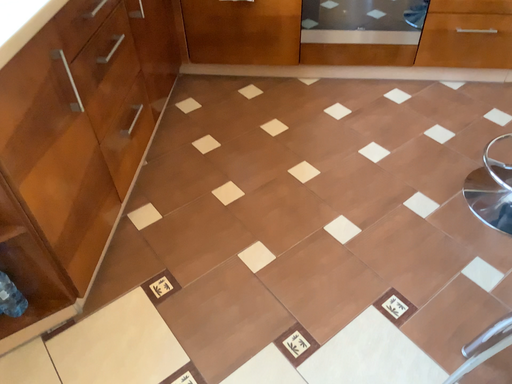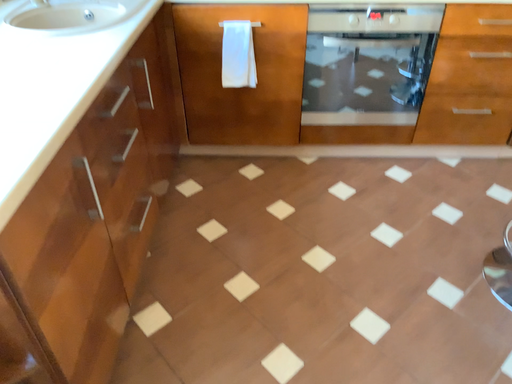
Question: How did the camera likely rotate when shooting the video?

Choices:
 (A) rotated upward
 (B) rotated downward

Answer: (A)